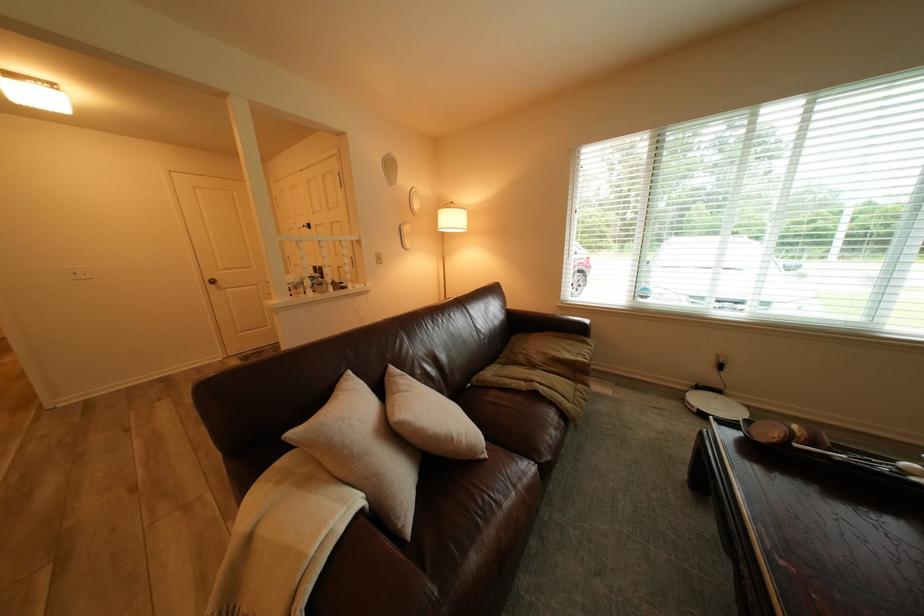
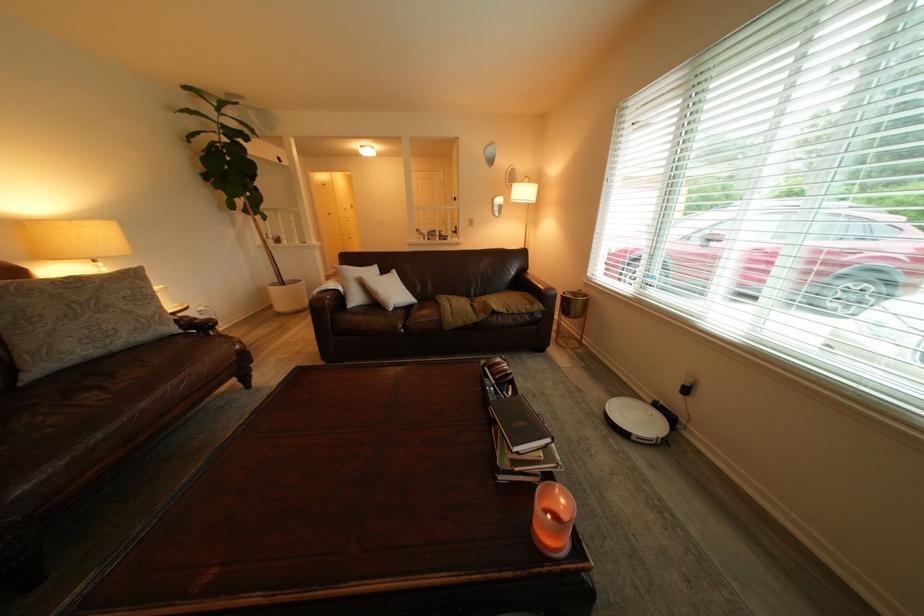
Locate, in the second image, the point that corresponds to the point at 468,438 in the first image.

(393, 294)